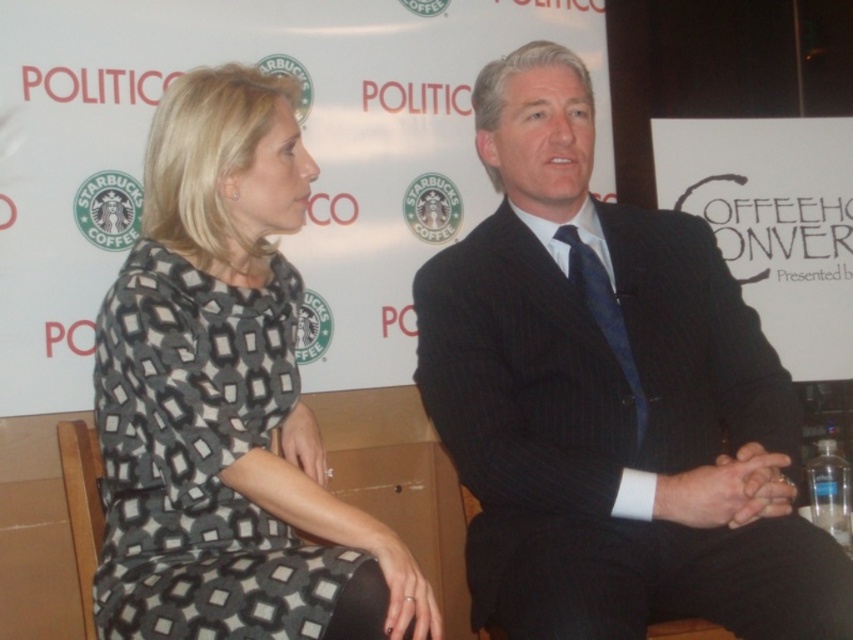
Question: Is black pinstripe suit at center to the left of printed fabric dress at center from the viewer's perspective?

Choices:
 (A) yes
 (B) no

Answer: (B)

Question: Among these objects, which one is farthest from the camera?

Choices:
 (A) printed fabric dress at center
 (B) black pinstripe suit at center

Answer: (B)

Question: Where is black pinstripe suit at center located in relation to printed fabric dress at center in the image?

Choices:
 (A) below
 (B) above

Answer: (B)

Question: From the image, what is the correct spatial relationship of black pinstripe suit at center in relation to printed fabric dress at center?

Choices:
 (A) above
 (B) below

Answer: (A)